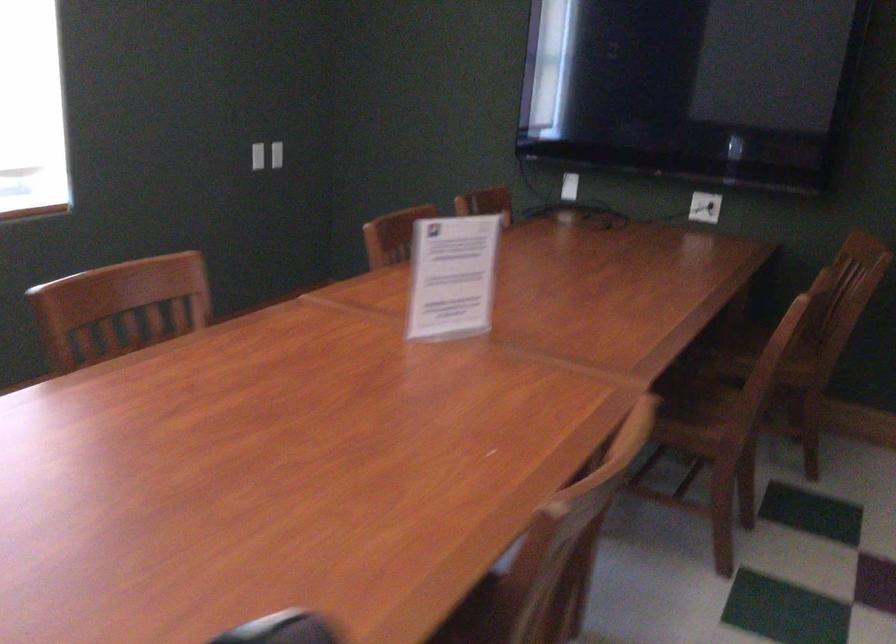
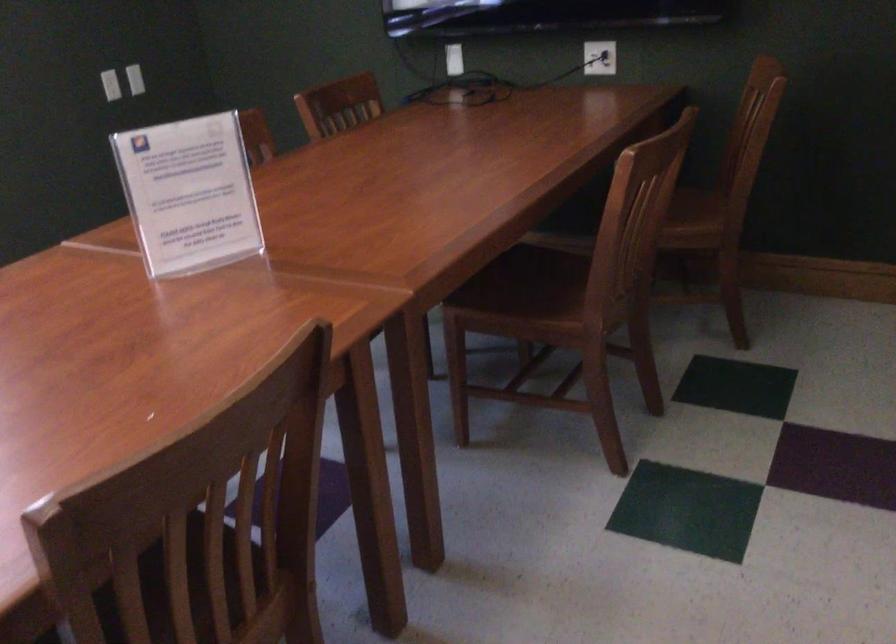
Where in the second image is the point corresponding to point (711, 204) from the first image?

(599, 58)